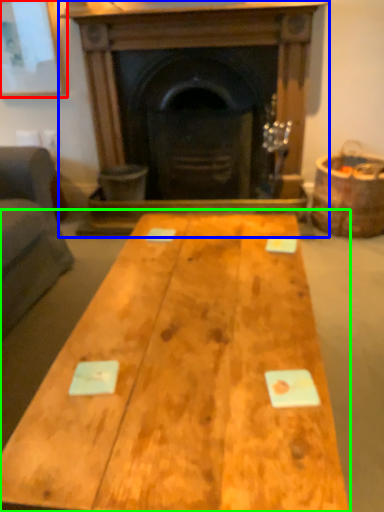
Question: Considering the real-world distances, which object is closest to picture frame (highlighted by a red box)? fireplace (highlighted by a blue box) or table (highlighted by a green box).

Choices:
 (A) fireplace
 (B) table

Answer: (A)